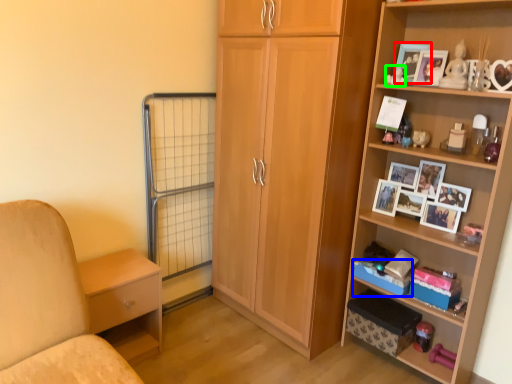
Question: Considering the real-world distances, which object is farthest from picture frame (highlighted by a red box)? storage box (highlighted by a blue box) or toy (highlighted by a green box)?

Choices:
 (A) storage box
 (B) toy

Answer: (A)